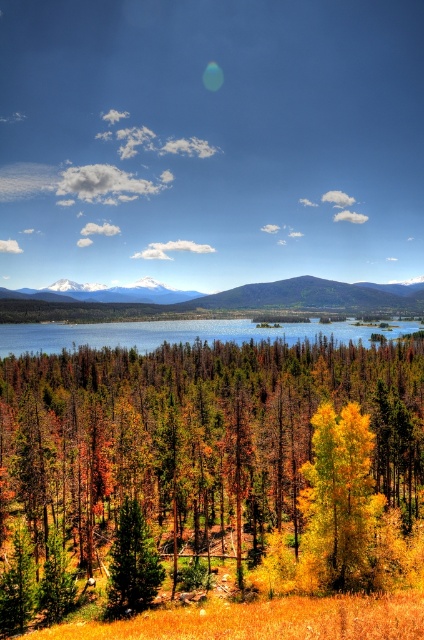
Question: Is green matte tree at center wider than snowy peak at center?

Choices:
 (A) no
 (B) yes

Answer: (A)

Question: Which point appears farthest from the camera in this image?

Choices:
 (A) (47, 344)
 (B) (36, 417)

Answer: (A)

Question: From the image, what is the correct spatial relationship of green matte tree at center in relation to snowy peak at center?

Choices:
 (A) left
 (B) right

Answer: (B)

Question: Which object appears closest to the camera in this image?

Choices:
 (A) green matte tree at center
 (B) snowy peak at center
 (C) yellow matte tree at center

Answer: (C)

Question: Is yellow matte tree at center smaller than green matte tree at center?

Choices:
 (A) no
 (B) yes

Answer: (A)

Question: Estimate the real-world distances between objects in this image. Which object is closer to the green matte tree at center?

Choices:
 (A) snowy peak at center
 (B) yellow matte tree at center

Answer: (B)